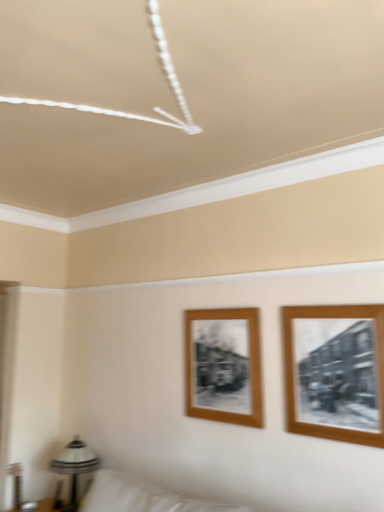
Question: Considering their positions, is metallic silver table lamp at lower left located in front of or behind wooden framed photo at right, the 2th picture frame from the back?

Choices:
 (A) front
 (B) behind

Answer: (B)

Question: Is point (71, 504) closer or farther from the camera than point (355, 399)?

Choices:
 (A) farther
 (B) closer

Answer: (A)

Question: Which of these objects is positioned closest to the wooden framed photo at right, the 2th picture frame from the back?

Choices:
 (A) metallic silver table lamp at lower left
 (B) wooden frame at center, which is counted as the first picture frame, starting from the back

Answer: (B)

Question: Estimate the real-world distances between objects in this image. Which object is farther from the wooden framed photo at right, the 2th picture frame from the back?

Choices:
 (A) wooden frame at center, which ranks as the 1th picture frame in left-to-right order
 (B) metallic silver table lamp at lower left

Answer: (B)